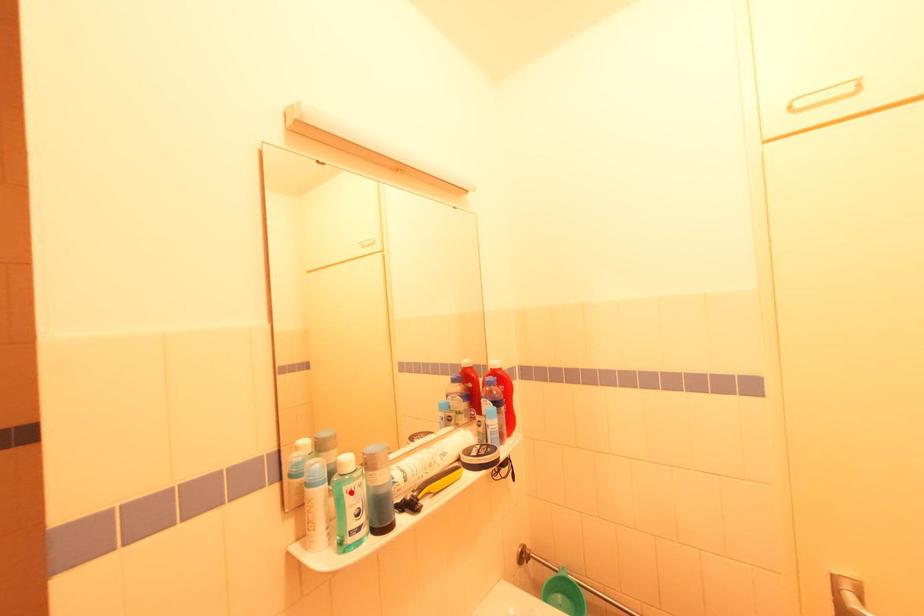
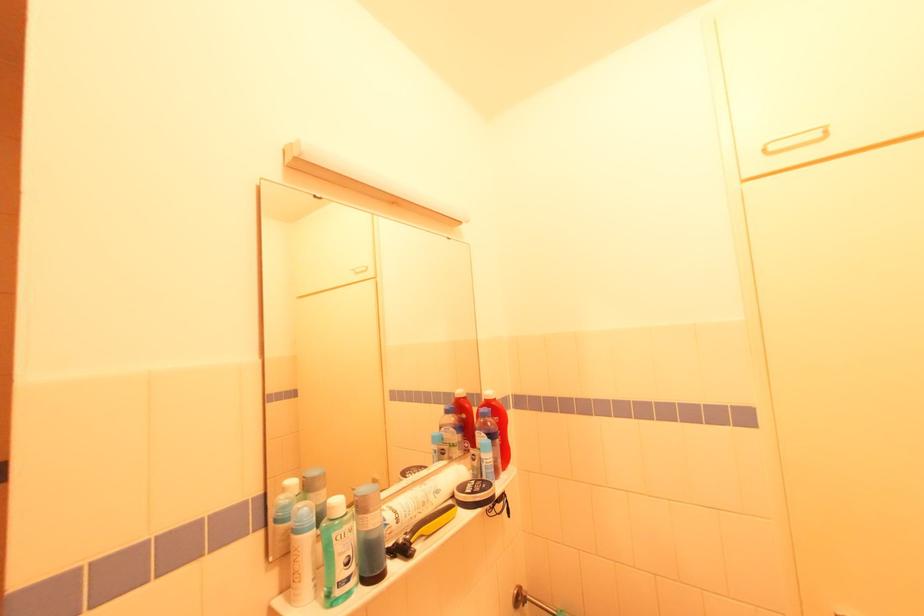
In the second image, find the point that corresponds to the highlighted location in the first image.

(341, 539)